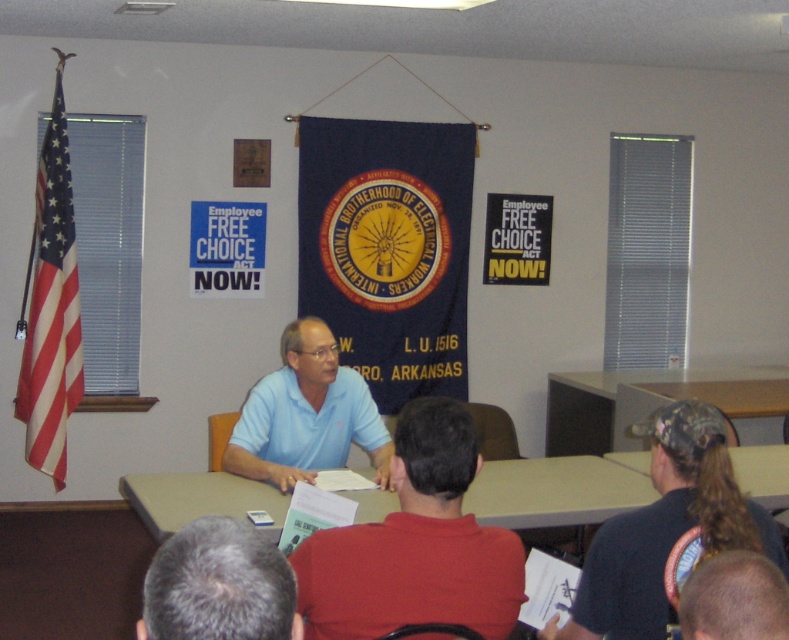
Question: Which object is closer to the camera taking this photo?

Choices:
 (A) light blue polo shirt at center
 (B) gray hair at lower left
 (C) red-white striped flag at left
 (D) black cap at center

Answer: (B)

Question: Is brown wood table at center positioned in front of smooth bald head at lower right?

Choices:
 (A) no
 (B) yes

Answer: (A)

Question: Can you confirm if red-white striped flag at left is positioned below smooth bald head at lower right?

Choices:
 (A) no
 (B) yes

Answer: (A)

Question: Which of the following is the closest to the observer?

Choices:
 (A) (156, 497)
 (B) (571, 394)
 (C) (361, 580)

Answer: (C)

Question: Can you confirm if light blue polo shirt at center is positioned to the right of light blue cotton shirt at center?

Choices:
 (A) no
 (B) yes

Answer: (B)

Question: Which point appears closest to the camera in this image?

Choices:
 (A) (369, 496)
 (B) (234, 636)
 (C) (561, 394)

Answer: (B)